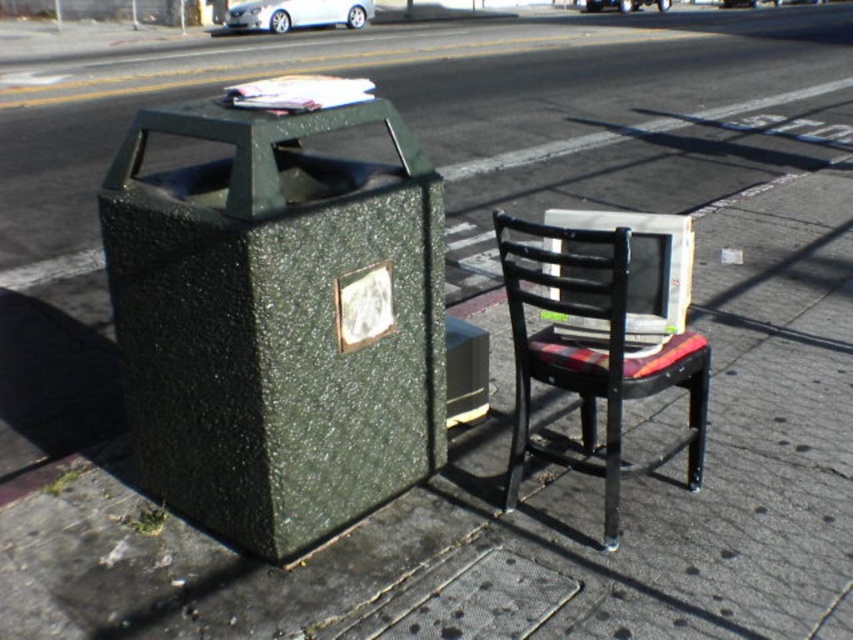
Question: Is green speckled trash can at left above plaid fabric chair at center?

Choices:
 (A) no
 (B) yes

Answer: (B)

Question: Which point is closer to the camera?

Choices:
 (A) green speckled trash can at left
 (B) plaid fabric chair at center

Answer: (A)

Question: In this image, where is green speckled trash can at left located relative to plaid fabric chair at center?

Choices:
 (A) left
 (B) right

Answer: (A)

Question: Is green speckled trash can at left thinner than plaid fabric chair at center?

Choices:
 (A) no
 (B) yes

Answer: (A)